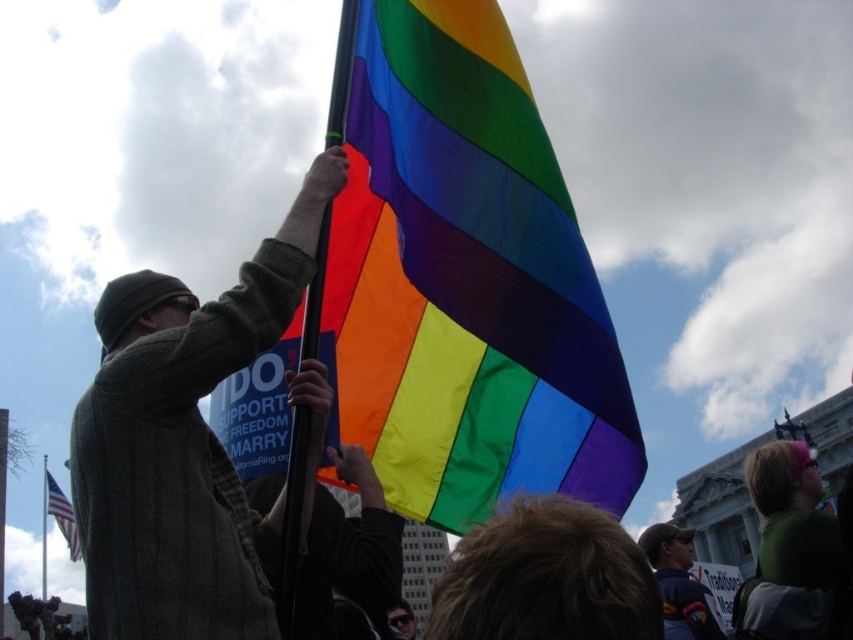
Does dark blue baseball cap at lower right appear under american flag at lower left?

No.

Does dark blue baseball cap at lower right have a greater height compared to american flag at lower left?

Yes.

Consider the image. Measure the distance between dark blue baseball cap at lower right and camera.

The distance of dark blue baseball cap at lower right from camera is 35.55 meters.

Locate an element on the screen. This screenshot has width=853, height=640. dark blue baseball cap at lower right is located at coordinates (680, 584).

From the picture: Does knit green sweater at center have a lesser width compared to dark blue baseball cap at lower right?

Correct, knit green sweater at center's width is less than dark blue baseball cap at lower right's.

Identify the location of knit green sweater at center. (183, 442).

Where is `knit green sweater at center`? This screenshot has height=640, width=853. knit green sweater at center is located at coordinates (x=183, y=442).

Does rainbow fabric flag at center have a greater width compared to dark blue baseball cap at lower right?

Incorrect, rainbow fabric flag at center's width does not surpass dark blue baseball cap at lower right's.

Between rainbow fabric flag at center and dark blue baseball cap at lower right, which one is positioned higher?

Positioned higher is rainbow fabric flag at center.

Where is `rainbow fabric flag at center`? Image resolution: width=853 pixels, height=640 pixels. rainbow fabric flag at center is located at coordinates (466, 280).